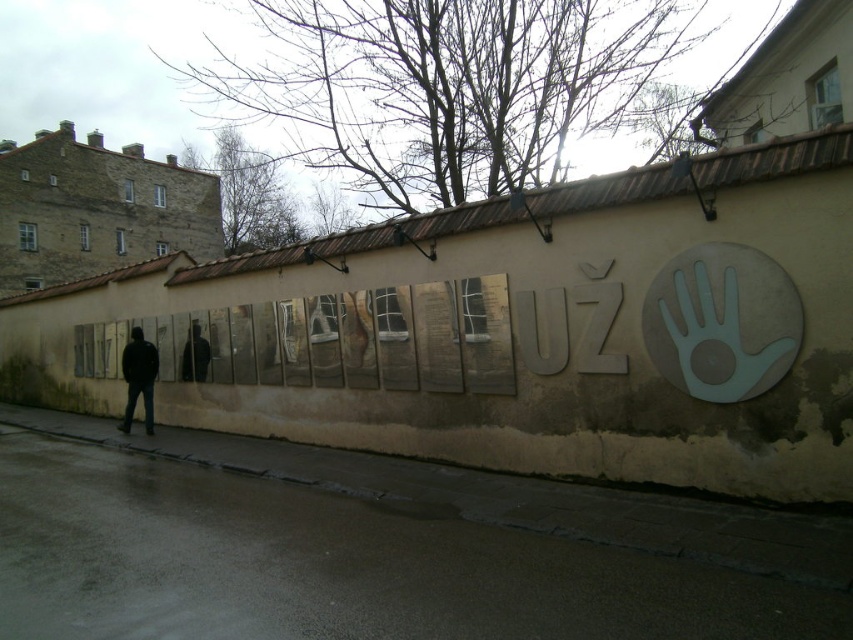
Question: Among these objects, which one is nearest to the camera?

Choices:
 (A) matte gray letters at center
 (B) dark blue jeans at left

Answer: (A)

Question: Considering the real-world distances, which object is closest to the matte gray letters at center?

Choices:
 (A) black matte jacket at center
 (B) dark blue jeans at left

Answer: (A)

Question: Does matte gray letters at center appear on the left side of black matte jacket at center?

Choices:
 (A) no
 (B) yes

Answer: (A)

Question: Is dark blue jeans at left to the right of black matte jacket at center from the viewer's perspective?

Choices:
 (A) yes
 (B) no

Answer: (B)

Question: Which point is closer to the camera taking this photo?

Choices:
 (A) (618, 362)
 (B) (135, 353)

Answer: (A)

Question: Does matte gray letters at center lie behind black matte jacket at center?

Choices:
 (A) no
 (B) yes

Answer: (A)